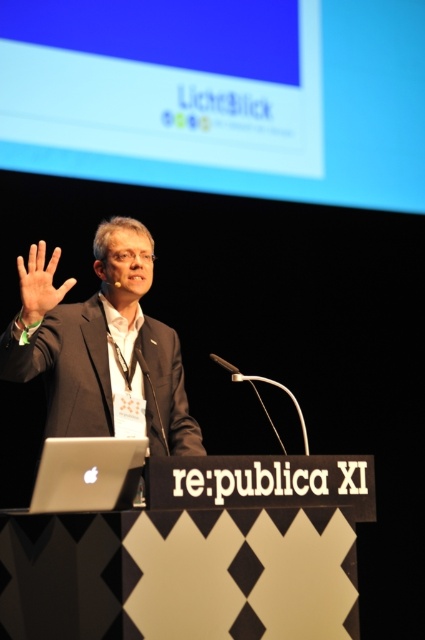
Does dark gray suit at center appear under silver metallic laptop at lower left?

Incorrect, dark gray suit at center is not positioned below silver metallic laptop at lower left.

Which is more to the right, dark gray suit at center or silver metallic laptop at lower left?

From the viewer's perspective, dark gray suit at center appears more on the right side.

Who is more distant from viewer, (x=34, y=301) or (x=82, y=481)?

The point (x=34, y=301) is more distant.

At what (x,y) coordinates should I click in order to perform the action: click on dark gray suit at center. Please return your answer as a coordinate pair (x, y). Looking at the image, I should click on (101, 342).

Image resolution: width=425 pixels, height=640 pixels. Describe the element at coordinates (220, 96) in the screenshot. I see `blue matte screen at upper center` at that location.

Between blue matte screen at upper center and matte black hand at upper left, which one appears on the right side from the viewer's perspective?

From the viewer's perspective, blue matte screen at upper center appears more on the right side.

The width and height of the screenshot is (425, 640). Describe the element at coordinates (220, 96) in the screenshot. I see `blue matte screen at upper center` at that location.

Locate an element on the screen. Image resolution: width=425 pixels, height=640 pixels. blue matte screen at upper center is located at coordinates (220, 96).

Consider the image. Can you confirm if silver metallic laptop at lower left is thinner than matte black hand at upper left?

In fact, silver metallic laptop at lower left might be wider than matte black hand at upper left.

Identify the location of silver metallic laptop at lower left. (87, 474).